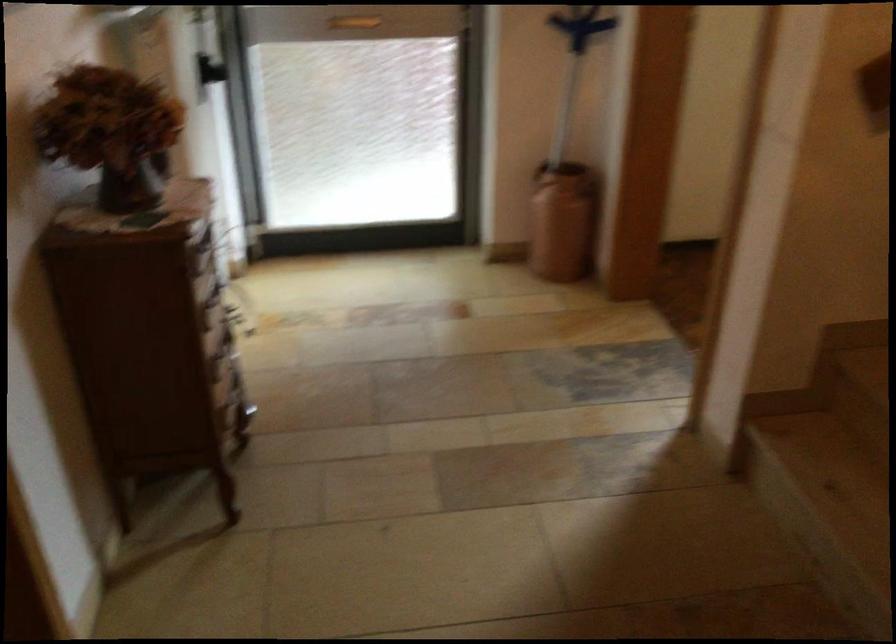
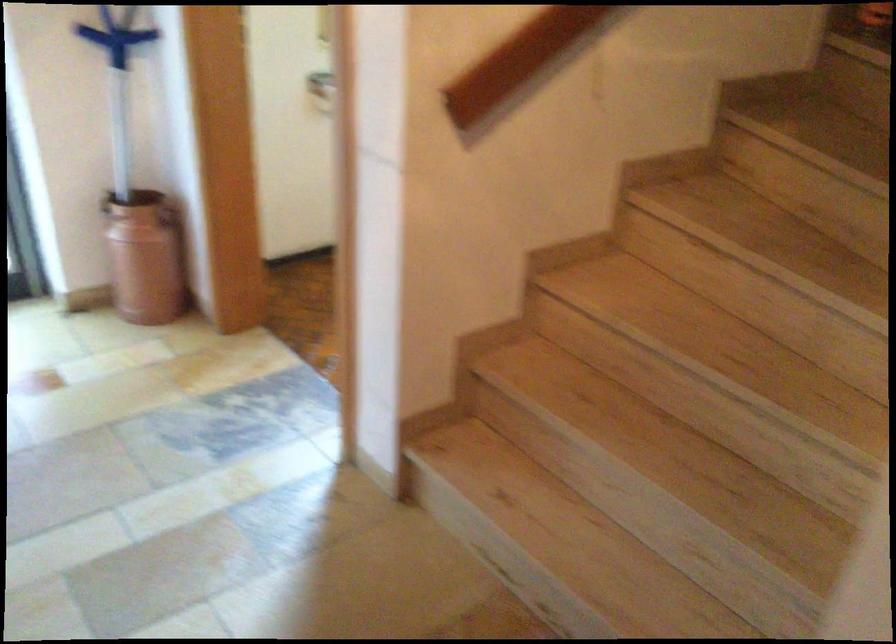
Question: The images are taken continuously from a first-person perspective. In which direction is your viewpoint rotating?

Choices:
 (A) Left
 (B) Right
 (C) Up
 (D) Down

Answer: (B)